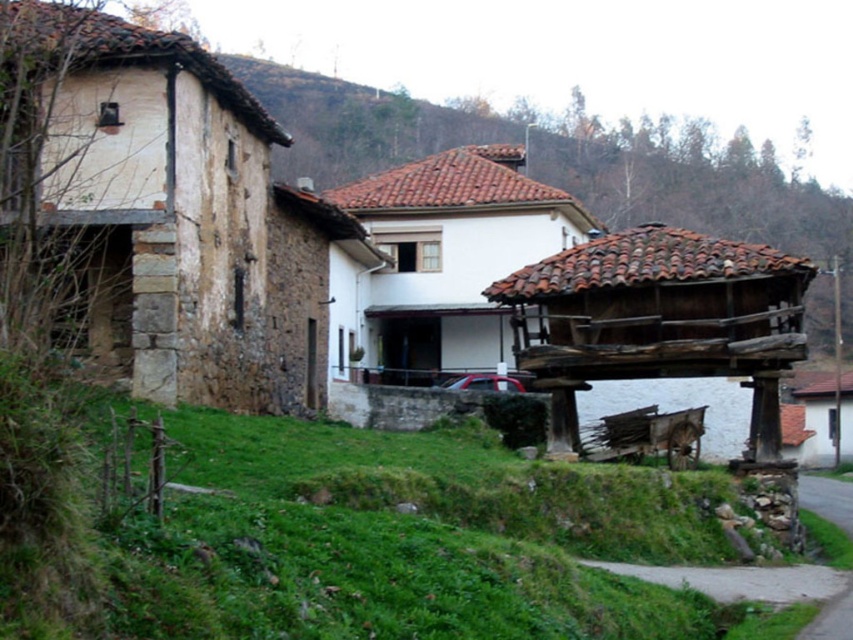
You are planning to build a new garden shed and have two options for locations based on the image. The first location is near the stone textured hut at left, and the second is near the white stucco house at center. Considering the sizes of these structures, which location would allow for a larger shed without overcrowding the area?

The white stucco house at center is larger than the stone textured hut at left, so building a shed near the white stucco house at center would allow for a larger shed without overcrowding the area.

You are standing at the point marked by coordinates (700, 192) in the rural scene. Looking around, you see a brown stone house at center. Can you confirm if you are currently inside the brown stone house at center?

The point (700, 192) represents the brown stone house at center, so yes, you are inside the brown stone house at center.